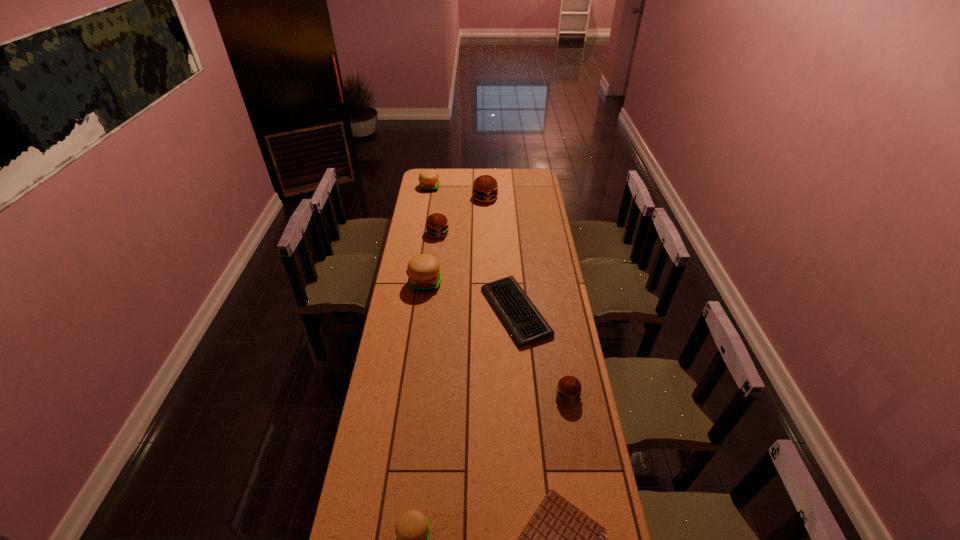
Image resolution: width=960 pixels, height=540 pixels. I want to click on the biggest brown hamburger, so click(x=485, y=188).

Where is `the second brown hamburger from right to left`? This screenshot has width=960, height=540. the second brown hamburger from right to left is located at coordinates click(485, 188).

Find the location of a particular element. This screenshot has width=960, height=540. the second farthest beige hamburger is located at coordinates (424, 273).

The image size is (960, 540). In order to click on the biggest beige hamburger in this screenshot , I will do `click(424, 273)`.

The height and width of the screenshot is (540, 960). What are the coordinates of `the fourth nearest hamburger` in the screenshot? It's located at (437, 225).

At what (x,y) coordinates should I click in order to perform the action: click on the second biggest brown hamburger. Please return your answer as a coordinate pair (x, y). The height and width of the screenshot is (540, 960). Looking at the image, I should click on (437, 225).

Where is `the farthest beige hamburger`? This screenshot has height=540, width=960. the farthest beige hamburger is located at coordinates (428, 178).

Identify the location of the rightmost brown hamburger. tap(568, 389).

The image size is (960, 540). What are the coordinates of `the sixth farthest object` in the screenshot? It's located at (568, 389).

Locate an element on the screen. This screenshot has height=540, width=960. computer keyboard is located at coordinates click(526, 325).